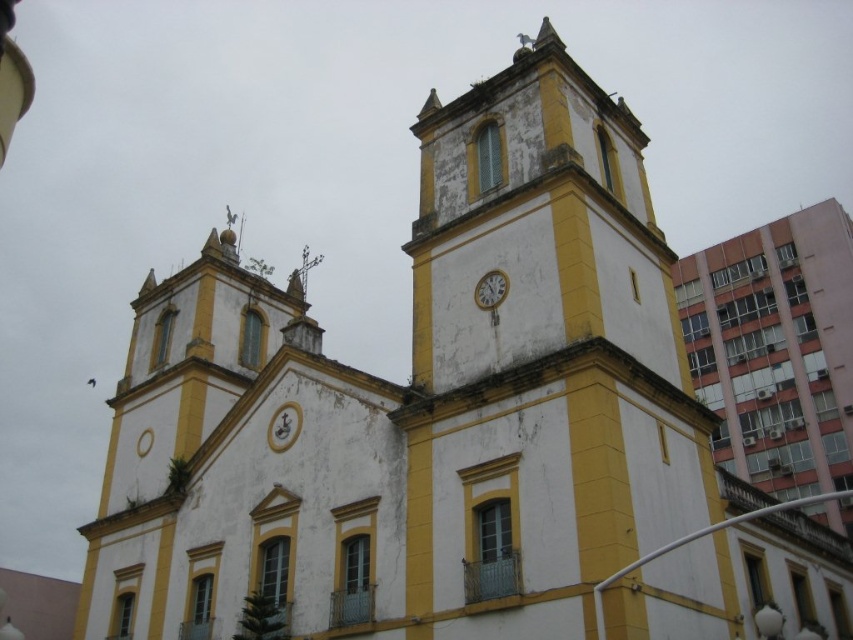
Which is below, yellow matte clock tower at center or metallic silver clock at center?

Positioned lower is metallic silver clock at center.

Is point (624, 237) positioned behind point (495, 282)?

Yes, point (624, 237) is farther from viewer.

What do you see at coordinates (540, 360) in the screenshot? I see `yellow matte clock tower at center` at bounding box center [540, 360].

Find the location of a particular element. The width and height of the screenshot is (853, 640). yellow matte clock tower at center is located at coordinates (540, 360).